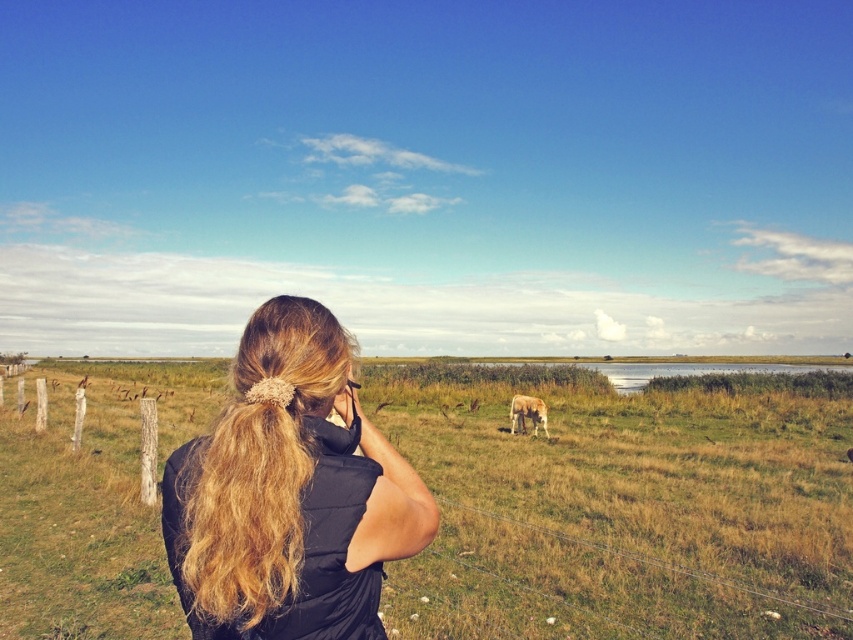
Is point (180, 436) positioned before point (540, 401)?

Yes, it is in front of point (540, 401).

Where is `green grass at center`? green grass at center is located at coordinates (622, 509).

Identify the location of green grass at center. The image size is (853, 640). (622, 509).

Is green grass at center shorter than blonde hair at center?

No.

Can you confirm if green grass at center is taller than blonde hair at center?

Correct, green grass at center is much taller as blonde hair at center.

Does point (636, 408) come closer to viewer compared to point (323, 545)?

No, (636, 408) is further to viewer.

Where is `green grass at center`? green grass at center is located at coordinates (622, 509).

Between blonde hair at center and white fur horse at center, which one appears on the left side from the viewer's perspective?

From the viewer's perspective, blonde hair at center appears more on the left side.

What do you see at coordinates (289, 492) in the screenshot? This screenshot has height=640, width=853. I see `blonde hair at center` at bounding box center [289, 492].

Where is `blonde hair at center`? This screenshot has width=853, height=640. blonde hair at center is located at coordinates (289, 492).